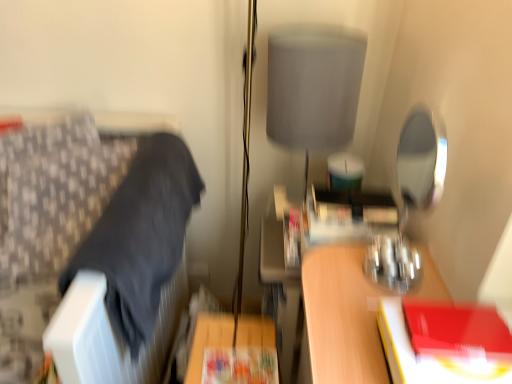
Question: Can you confirm if matte paper paperback book at center, the 1th paperback book viewed from the back, is taller than gray fabric lampshade at upper center?

Choices:
 (A) yes
 (B) no

Answer: (B)

Question: From the image's perspective, is matte paper paperback book at center, the 2th paperback book viewed from the front, under gray fabric lampshade at upper center?

Choices:
 (A) yes
 (B) no

Answer: (A)

Question: Does matte paper paperback book at center, the 2th paperback book positioned from the right, have a lesser width compared to gray fabric lampshade at upper center?

Choices:
 (A) no
 (B) yes

Answer: (B)

Question: Does matte paper paperback book at center, positioned as the first paperback book in left-to-right order, have a greater width compared to gray fabric lampshade at upper center?

Choices:
 (A) no
 (B) yes

Answer: (A)

Question: Is the surface of matte paper paperback book at center, which is the first paperback book in bottom-to-top order, in direct contact with gray fabric lampshade at upper center?

Choices:
 (A) no
 (B) yes

Answer: (A)

Question: Can you confirm if matte paper paperback book at center, which is the first paperback book in bottom-to-top order, is positioned to the right of gray fabric lampshade at upper center?

Choices:
 (A) no
 (B) yes

Answer: (A)

Question: From a real-world perspective, is gray fabric lampshade at upper center beneath matte paper paperback book at center, the 2th paperback book positioned from the right?

Choices:
 (A) no
 (B) yes

Answer: (A)

Question: Is gray fabric lampshade at upper center facing towards matte paper paperback book at center, which is the second paperback book in top-to-bottom order?

Choices:
 (A) no
 (B) yes

Answer: (A)

Question: From the image's perspective, would you say gray fabric lampshade at upper center is positioned over matte paper paperback book at center, the 1th paperback book viewed from the back?

Choices:
 (A) no
 (B) yes

Answer: (B)

Question: Is gray fabric lampshade at upper center positioned behind matte paper paperback book at center, the 1th paperback book viewed from the back?

Choices:
 (A) yes
 (B) no

Answer: (A)

Question: Is gray fabric lampshade at upper center turned away from matte paper paperback book at center, the 2th paperback book viewed from the front?

Choices:
 (A) yes
 (B) no

Answer: (B)

Question: Does gray fabric lampshade at upper center have a greater width compared to matte paper paperback book at center, the 1th paperback book viewed from the back?

Choices:
 (A) no
 (B) yes

Answer: (B)

Question: Is patterned fabric cushion at left far away from matte paper paperback book at center, the 2th paperback book positioned from the right?

Choices:
 (A) no
 (B) yes

Answer: (A)